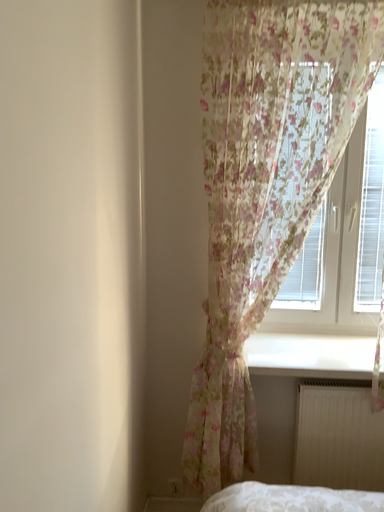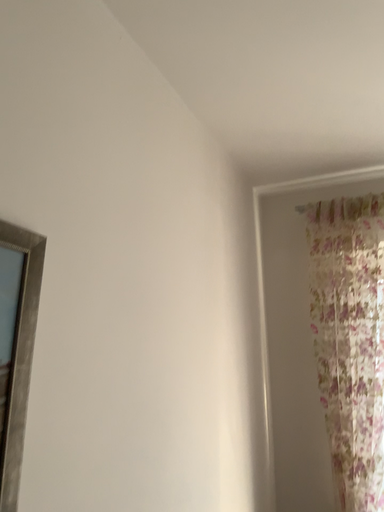
Question: How did the camera likely rotate when shooting the video?

Choices:
 (A) rotated right
 (B) rotated left

Answer: (B)